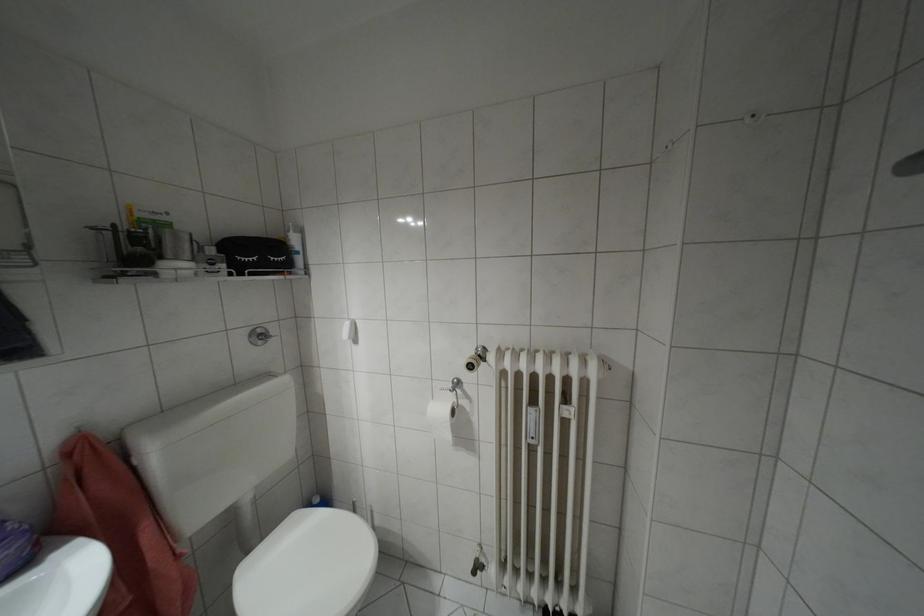
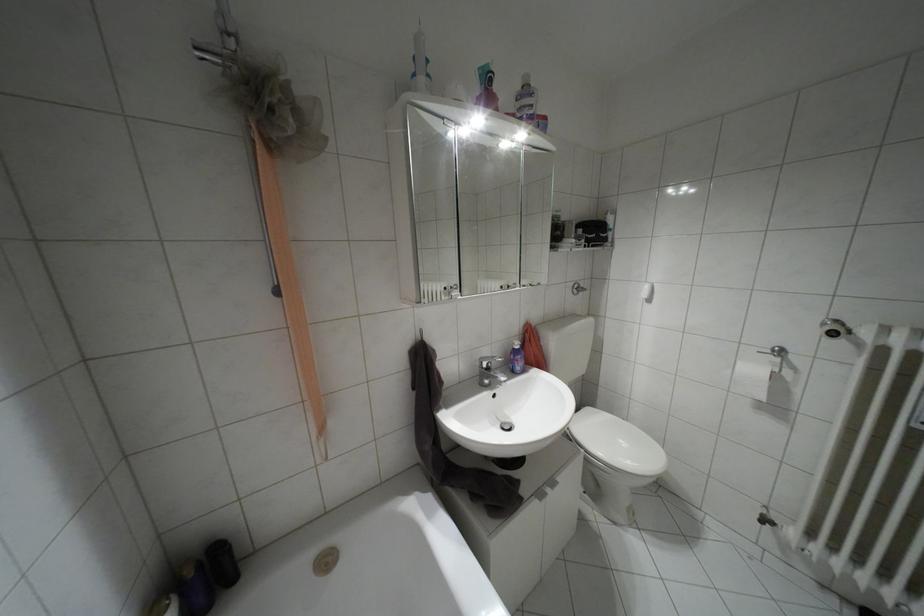
Question: The first image is from the beginning of the video and the second image is from the end. How did the camera likely rotate when shooting the video?

Choices:
 (A) Left
 (B) Right
 (C) Up
 (D) Down

Answer: (A)